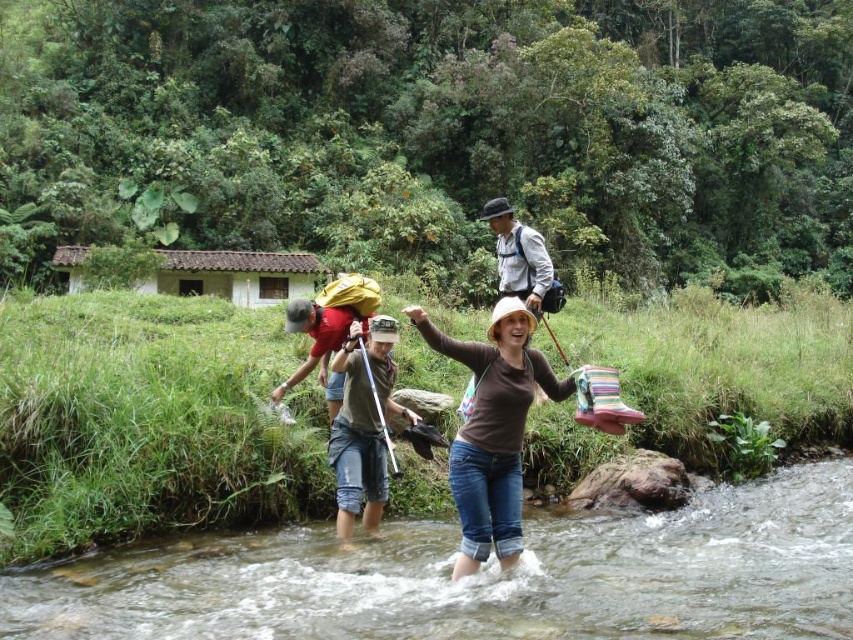
Question: Which object appears closest to the camera in this image?

Choices:
 (A) brown cotton shirt at center
 (B) clear water at river center
 (C) brown matte shirt at center

Answer: (C)

Question: In this image, where is clear water at river center located relative to brown cotton shirt at center?

Choices:
 (A) right
 (B) left

Answer: (B)

Question: Is clear water at river center bigger than brown cotton shirt at center?

Choices:
 (A) no
 (B) yes

Answer: (A)

Question: Based on their relative distances, which object is farther from the brown matte shirt at center?

Choices:
 (A) brown cotton shirt at center
 (B) clear water at river center

Answer: (B)

Question: Can you confirm if brown matte shirt at center is positioned to the right of brown cotton shirt at center?

Choices:
 (A) yes
 (B) no

Answer: (A)

Question: Which point is farther to the camera?

Choices:
 (A) (715, 518)
 (B) (524, 362)
 (C) (352, 477)

Answer: (A)